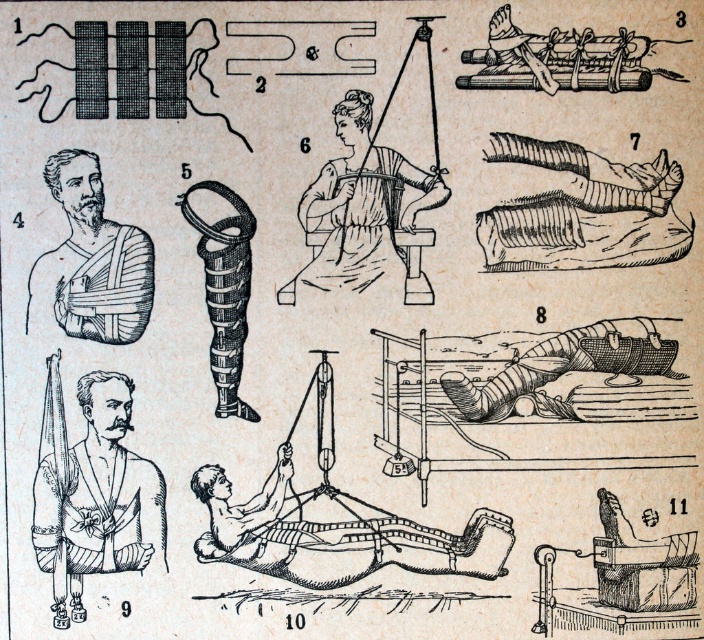
Can you confirm if matte brown bandages at center is positioned to the right of smooth white dress at center?

In fact, matte brown bandages at center is to the left of smooth white dress at center.

Consider the image. Who is taller, matte brown bandages at center or smooth white dress at center?

matte brown bandages at center is taller.

Locate an element on the screen. The width and height of the screenshot is (704, 640). matte brown bandages at center is located at coordinates (94, 492).

Is wooden board at center shorter than smooth white dress at center?

Indeed, wooden board at center has a lesser height compared to smooth white dress at center.

Is wooden board at center bigger than smooth white dress at center?

Yes, wooden board at center is bigger than smooth white dress at center.

You are a GUI agent. You are given a task and a screenshot of the screen. Output one action in this format:
    pyautogui.click(x=<x>, y=<y>)
    Task: Click on the wooden board at center
    The width and height of the screenshot is (704, 640).
    Given the screenshot: What is the action you would take?
    pyautogui.click(x=337, y=532)

Who is lower down, smooth white dress at center or matte wooden leg at center?

Positioned lower is matte wooden leg at center.

Who is more distant from viewer, (375, 211) or (601, 344)?

The point (375, 211) is more distant.

Identify the location of smooth white dress at center. The height and width of the screenshot is (640, 704). [x=364, y=209].